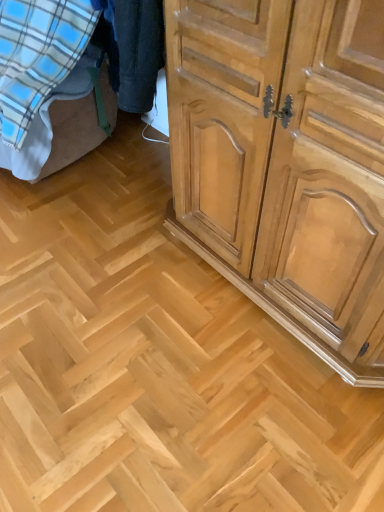
Locate an element on the screen. light brown wood cabinet at right is located at coordinates pyautogui.click(x=286, y=163).

The height and width of the screenshot is (512, 384). What do you see at coordinates (286, 163) in the screenshot?
I see `light brown wood cabinet at right` at bounding box center [286, 163].

The width and height of the screenshot is (384, 512). What do you see at coordinates (95, 86) in the screenshot?
I see `blue plaid fabric at lower left` at bounding box center [95, 86].

The height and width of the screenshot is (512, 384). I want to click on blue plaid fabric at lower left, so click(x=95, y=86).

Measure the distance between blue plaid fabric at lower left and camera.

The depth of blue plaid fabric at lower left is 5.15 feet.

Where is `light brown wood cabinet at right`? This screenshot has height=512, width=384. light brown wood cabinet at right is located at coordinates (286, 163).

Which object is positioned more to the right, light brown wood cabinet at right or blue plaid fabric at lower left?

light brown wood cabinet at right.

Does light brown wood cabinet at right come behind blue plaid fabric at lower left?

No, the depth of light brown wood cabinet at right is less than that of blue plaid fabric at lower left.

Consider the image. Which is closer to the camera, (327, 125) or (84, 51)?

Point (327, 125).

From the picture: From the image's perspective, does light brown wood cabinet at right appear lower than blue plaid fabric at lower left?

Correct, light brown wood cabinet at right appears lower than blue plaid fabric at lower left in the image.

From a real-world perspective, who is located lower, light brown wood cabinet at right or blue plaid fabric at lower left?

From a 3D spatial view, blue plaid fabric at lower left is below.

Does light brown wood cabinet at right have a greater width compared to blue plaid fabric at lower left?

No.

Considering the sizes of objects light brown wood cabinet at right and blue plaid fabric at lower left in the image provided, who is taller, light brown wood cabinet at right or blue plaid fabric at lower left?

Standing taller between the two is light brown wood cabinet at right.

Based on their sizes in the image, would you say light brown wood cabinet at right is bigger or smaller than blue plaid fabric at lower left?

Considering their sizes, light brown wood cabinet at right takes up less space than blue plaid fabric at lower left.

Is light brown wood cabinet at right inside or outside of blue plaid fabric at lower left?

light brown wood cabinet at right exists outside the volume of blue plaid fabric at lower left.

Is light brown wood cabinet at right not near blue plaid fabric at lower left?

That's not correct — light brown wood cabinet at right is a little close to blue plaid fabric at lower left.

Could you tell me if light brown wood cabinet at right is turned towards blue plaid fabric at lower left?

No, light brown wood cabinet at right is not aimed at blue plaid fabric at lower left.

How many degrees apart are the facing directions of light brown wood cabinet at right and blue plaid fabric at lower left?

light brown wood cabinet at right and blue plaid fabric at lower left are facing 6.63 degrees away from each other.

Measure the distance from light brown wood cabinet at right to blue plaid fabric at lower left.

36.70 inches.

Locate an element on the screen. This screenshot has width=384, height=512. chest of drawers lying on the right of blue plaid fabric at lower left is located at coordinates click(286, 163).

Between blue plaid fabric at lower left and light brown wood cabinet at right, which one appears on the left side from the viewer's perspective?

Positioned to the left is blue plaid fabric at lower left.

Is blue plaid fabric at lower left in front of or behind light brown wood cabinet at right in the image?

blue plaid fabric at lower left is behind light brown wood cabinet at right.

Is point (37, 97) less distant than point (173, 189)?

Yes, point (37, 97) is in front of point (173, 189).

From the image's perspective, relative to light brown wood cabinet at right, is blue plaid fabric at lower left above or below?

Clearly, from the image's perspective, blue plaid fabric at lower left is above light brown wood cabinet at right.

From a real-world perspective, is blue plaid fabric at lower left physically located above or below light brown wood cabinet at right?

In terms of real-world spatial position, blue plaid fabric at lower left is below light brown wood cabinet at right.

Considering the sizes of blue plaid fabric at lower left and light brown wood cabinet at right in the image, is blue plaid fabric at lower left wider or thinner than light brown wood cabinet at right?

Considering their sizes, blue plaid fabric at lower left looks broader than light brown wood cabinet at right.

Considering the sizes of blue plaid fabric at lower left and light brown wood cabinet at right in the image, is blue plaid fabric at lower left taller or shorter than light brown wood cabinet at right?

In the image, blue plaid fabric at lower left appears to be shorter than light brown wood cabinet at right.

Considering the sizes of objects blue plaid fabric at lower left and light brown wood cabinet at right in the image provided, who is smaller, blue plaid fabric at lower left or light brown wood cabinet at right?

light brown wood cabinet at right.

Is blue plaid fabric at lower left inside or outside of light brown wood cabinet at right?

blue plaid fabric at lower left exists outside the volume of light brown wood cabinet at right.

Is there a large distance between blue plaid fabric at lower left and light brown wood cabinet at right?

blue plaid fabric at lower left is near light brown wood cabinet at right, not far away.

In the scene shown: Is blue plaid fabric at lower left oriented away from light brown wood cabinet at right?

No, light brown wood cabinet at right is not at the back of blue plaid fabric at lower left.

How different are the orientations of blue plaid fabric at lower left and light brown wood cabinet at right in degrees?

There is a 6.63-degree angle between the facing directions of blue plaid fabric at lower left and light brown wood cabinet at right.

Measure the distance between blue plaid fabric at lower left and light brown wood cabinet at right.

blue plaid fabric at lower left and light brown wood cabinet at right are 36.70 inches apart.

Locate an element on the screen. Image resolution: width=384 pixels, height=512 pixels. bed on the left of light brown wood cabinet at right is located at coordinates (95, 86).

In order to click on chest of drawers that appears on the right of blue plaid fabric at lower left in this screenshot , I will do `click(286, 163)`.

Locate an element on the screen. Image resolution: width=384 pixels, height=512 pixels. the chest of drawers in front of the blue plaid fabric at lower left is located at coordinates (286, 163).